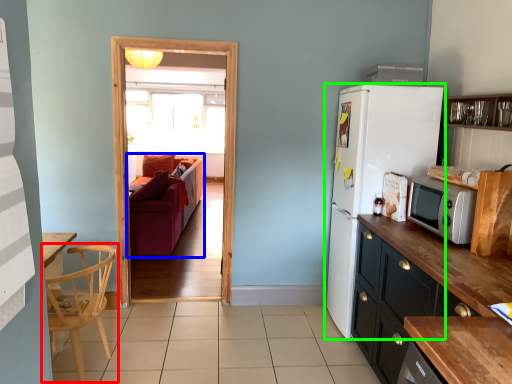
Question: Estimate the real-world distances between objects in this image. Which object is farther from chair (highlighted by a red box), studio couch (highlighted by a blue box) or refrigerator (highlighted by a green box)?

Choices:
 (A) studio couch
 (B) refrigerator

Answer: (A)